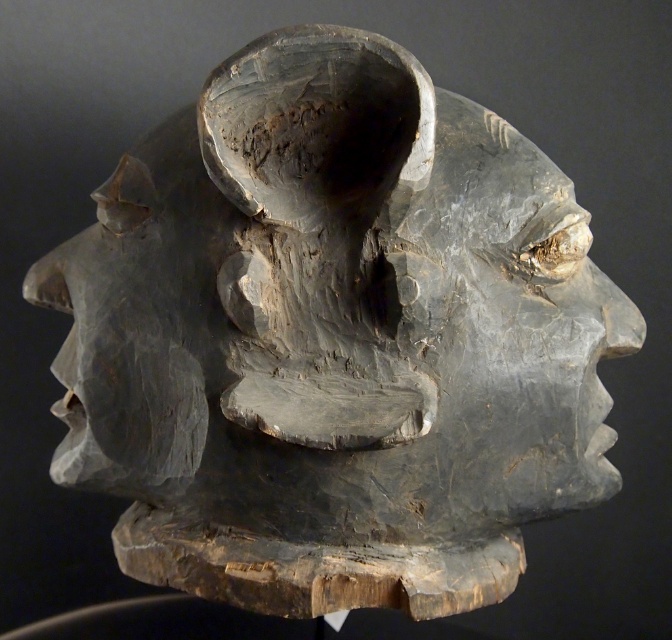
Question: Which object is farther from the camera taking this photo?

Choices:
 (A) matte gray stone face at left
 (B) gray wood carving at center

Answer: (A)

Question: Among these objects, which one is nearest to the camera?

Choices:
 (A) gray wood carving at center
 (B) matte gray stone face at left

Answer: (A)

Question: Can you confirm if gray wood carving at center is positioned above matte gray stone face at left?

Choices:
 (A) no
 (B) yes

Answer: (A)

Question: Does gray wood carving at center appear under matte gray stone face at left?

Choices:
 (A) yes
 (B) no

Answer: (A)

Question: Can you confirm if gray wood carving at center is positioned to the right of matte gray stone face at left?

Choices:
 (A) yes
 (B) no

Answer: (A)